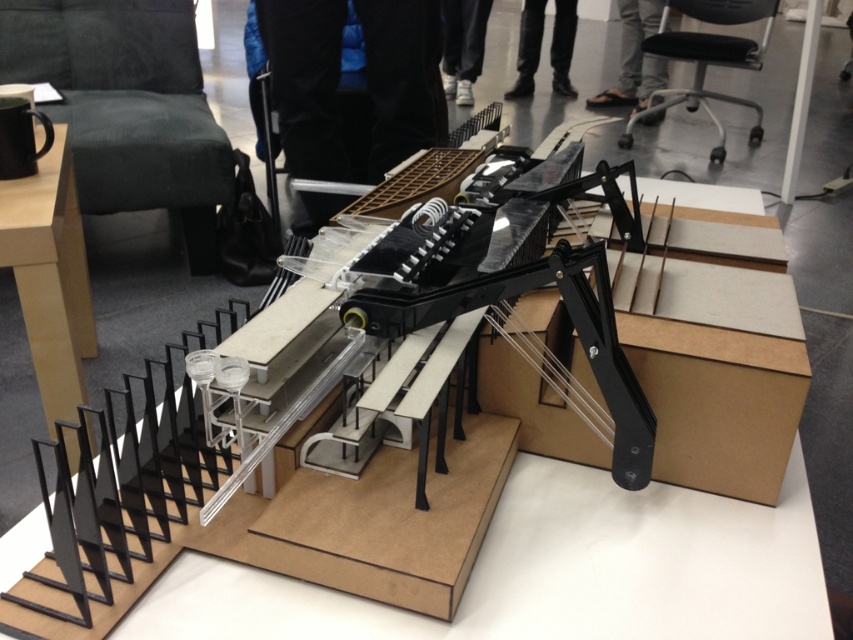
Is gray fabric pants at upper center shorter than white fabric pants at center?

No.

Which is more to the right, gray fabric pants at upper center or white fabric pants at center?

gray fabric pants at upper center is more to the right.

The height and width of the screenshot is (640, 853). What do you see at coordinates (635, 58) in the screenshot?
I see `gray fabric pants at upper center` at bounding box center [635, 58].

The height and width of the screenshot is (640, 853). I want to click on gray fabric pants at upper center, so click(635, 58).

Can you confirm if gray fabric pants at upper center is positioned below black leather pants at upper center?

Yes, gray fabric pants at upper center is below black leather pants at upper center.

Does gray fabric pants at upper center have a smaller size compared to black leather pants at upper center?

Incorrect, gray fabric pants at upper center is not smaller in size than black leather pants at upper center.

Which is in front, point (643, 1) or point (529, 88)?

Point (643, 1) is more forward.

At what (x,y) coordinates should I click in order to perform the action: click on gray fabric pants at upper center. Please return your answer as a coordinate pair (x, y). Image resolution: width=853 pixels, height=640 pixels. Looking at the image, I should click on (635, 58).

Between point (358, 19) and point (479, 12), which one is positioned in front?

Point (358, 19) is more forward.

Locate an element on the screen. This screenshot has height=640, width=853. black fabric pants at center is located at coordinates (366, 84).

The height and width of the screenshot is (640, 853). I want to click on black fabric pants at center, so (x=366, y=84).

The image size is (853, 640). Find the location of `black fabric pants at center`. black fabric pants at center is located at coordinates (x=366, y=84).